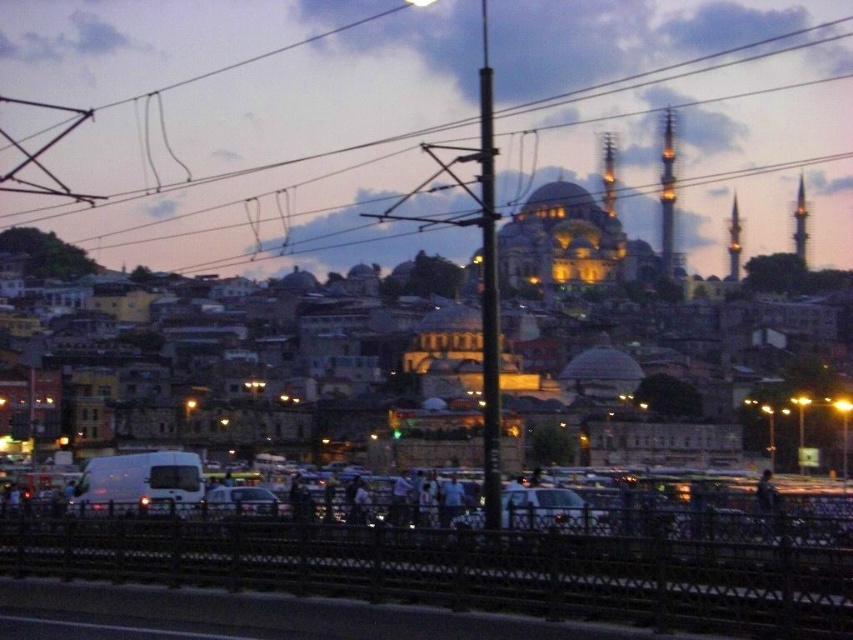
You are a city planner assessing traffic flow. You notice the metallic wire at upper center and the white matte car at center. Which object is wider?

The metallic wire at upper center is wider than the white matte car at center.

You are a drone operator planning to fly a drone through the area shown in the image. The drone has a maximum flight altitude of 1000 feet. Considering the metallic wire at upper center, can you safely fly the drone below it without exceeding its altitude limit?

The metallic wire at upper center is located 1389.80 feet away from the camera, which is higher than the drone maximum flight altitude of 1000 feet. Therefore, the drone can safely fly below the metallic wire at upper center without exceeding its altitude limit.

You are a drone operator trying to navigate your drone between the metallic wire at upper center and the white glossy car at center. Can you fly your drone between them?

The metallic wire at upper center is above the white glossy car at center, so yes, the drone can fly between them as there is vertical space available.